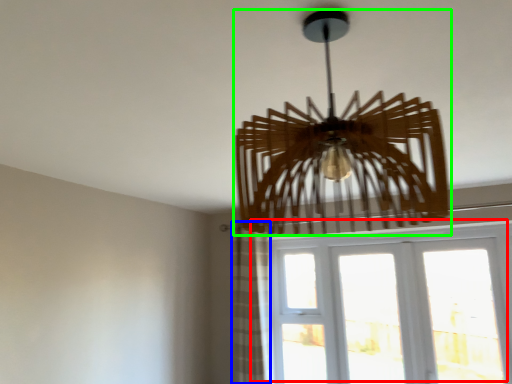
Question: Estimate the real-world distances between objects in this image. Which object is farther from window (highlighted by a red box), curtain (highlighted by a blue box) or lamp (highlighted by a green box)?

Choices:
 (A) curtain
 (B) lamp

Answer: (B)